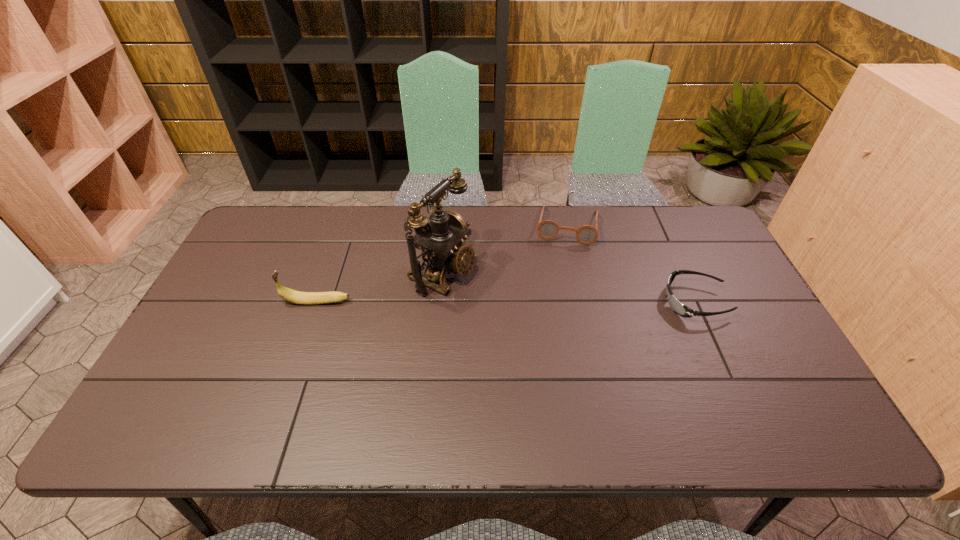
At what (x,y) coordinates should I click in order to perform the action: click on the third shortest object. Please return your answer as a coordinate pair (x, y). Looking at the image, I should click on (307, 298).

Find the location of a particular element. The height and width of the screenshot is (540, 960). banana is located at coordinates (307, 298).

Locate an element on the screen. the shortest object is located at coordinates (680, 309).

In order to click on the rightmost object in this screenshot , I will do `click(680, 309)`.

Where is `the tallest object`? The width and height of the screenshot is (960, 540). the tallest object is located at coordinates (440, 241).

Locate an element on the screen. telephone is located at coordinates (440, 241).

Find the location of a particular element. The height and width of the screenshot is (540, 960). the second shortest object is located at coordinates pos(547,229).

Image resolution: width=960 pixels, height=540 pixels. I want to click on the second object from right to left, so click(x=547, y=229).

Where is `free point located 0.200m at the stem of the banana`? This screenshot has height=540, width=960. free point located 0.200m at the stem of the banana is located at coordinates (211, 302).

Find the location of a particular element. The image size is (960, 540). blank space located 0.050m at the stem of the banana is located at coordinates (265, 302).